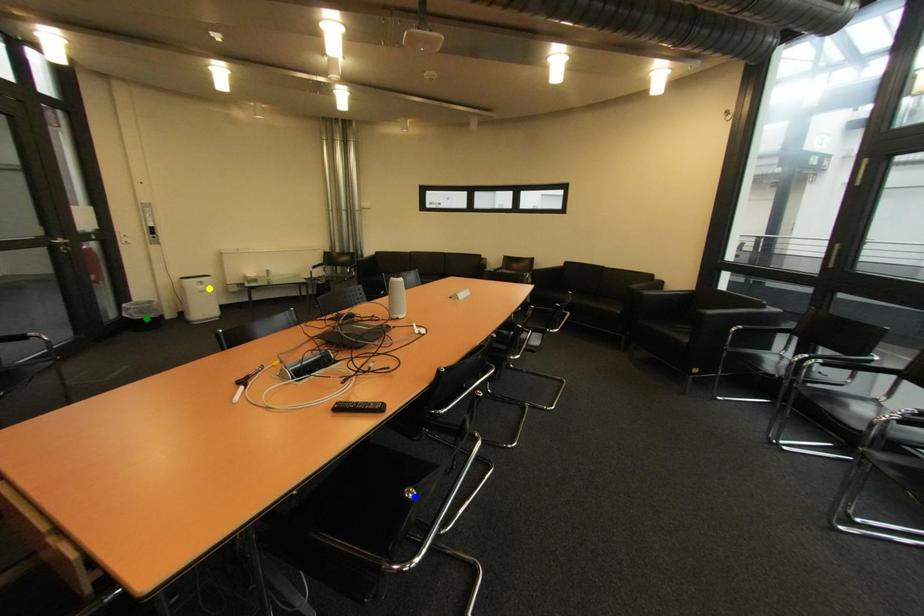
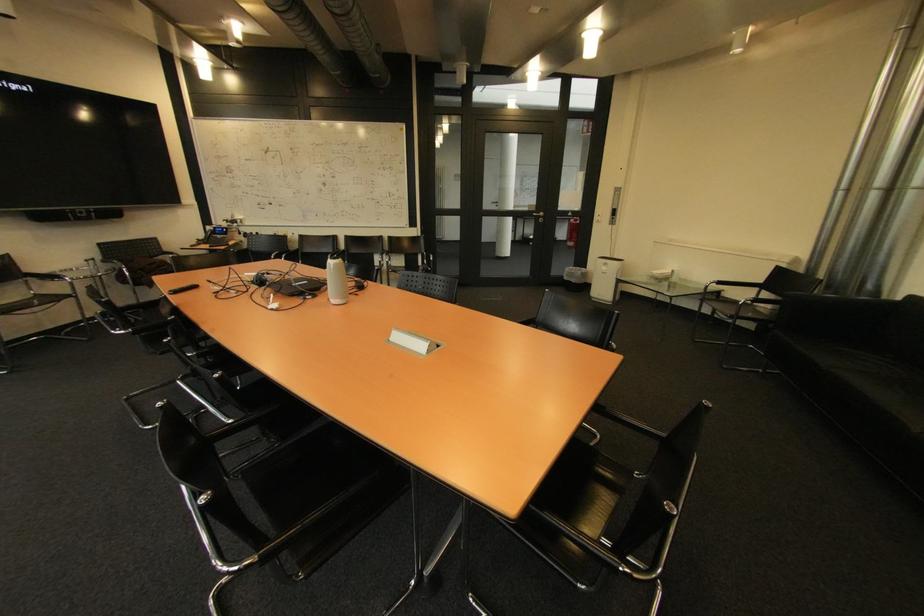
I am providing you with two images of the same scene from different viewpoints. Three points are marked in image1. Which point corresponds to a part or object that is occluded in image2?In image1, three points are marked. Which of them correspond to a part or object that is occluded in image2?Among the three points shown in image1, which one corresponds to a part or object that is no longer visible due to occlusion in image2?

blue point